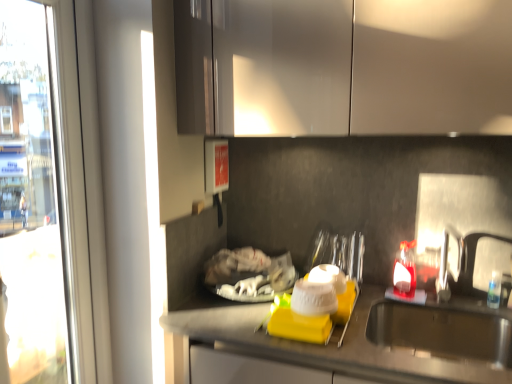
Question: Is translucent glass bottle at right facing away from transparent glass window at left?

Choices:
 (A) no
 (B) yes

Answer: (A)

Question: Is translucent glass bottle at right wider than transparent glass window at left?

Choices:
 (A) no
 (B) yes

Answer: (A)

Question: Is translucent glass bottle at right at the left side of transparent glass window at left?

Choices:
 (A) no
 (B) yes

Answer: (A)

Question: Considering the relative sizes of translucent glass bottle at right and transparent glass window at left in the image provided, is translucent glass bottle at right smaller than transparent glass window at left?

Choices:
 (A) yes
 (B) no

Answer: (A)

Question: Does translucent glass bottle at right have a lesser height compared to transparent glass window at left?

Choices:
 (A) yes
 (B) no

Answer: (A)

Question: Is translucent glass bottle at right at the right side of transparent glass window at left?

Choices:
 (A) yes
 (B) no

Answer: (A)

Question: Is stainless steel sink at lower right completely or partially inside transparent glass window at left?

Choices:
 (A) no
 (B) yes

Answer: (A)

Question: Considering the relative sizes of transparent glass window at left and stainless steel sink at lower right in the image provided, is transparent glass window at left shorter than stainless steel sink at lower right?

Choices:
 (A) no
 (B) yes

Answer: (A)

Question: Is transparent glass window at left oriented away from stainless steel sink at lower right?

Choices:
 (A) yes
 (B) no

Answer: (B)

Question: Can you confirm if transparent glass window at left is bigger than stainless steel sink at lower right?

Choices:
 (A) yes
 (B) no

Answer: (A)

Question: Considering the relative sizes of transparent glass window at left and stainless steel sink at lower right in the image provided, is transparent glass window at left smaller than stainless steel sink at lower right?

Choices:
 (A) yes
 (B) no

Answer: (B)

Question: Is transparent glass window at left positioned behind stainless steel sink at lower right?

Choices:
 (A) no
 (B) yes

Answer: (A)

Question: Considering the relative sizes of glossy white cabinets at upper center and stainless steel sink at lower right in the image provided, is glossy white cabinets at upper center bigger than stainless steel sink at lower right?

Choices:
 (A) yes
 (B) no

Answer: (A)